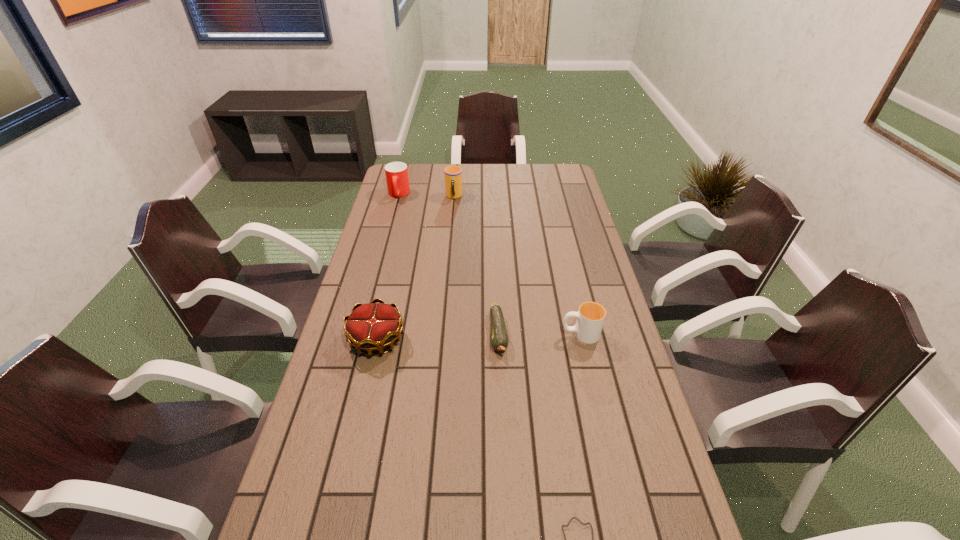
Identify the location of free space located with the handle on the side of the rightmost cup. The height and width of the screenshot is (540, 960). (517, 334).

Image resolution: width=960 pixels, height=540 pixels. I want to click on free space located on the back of the crown, so click(398, 244).

I want to click on vacant area located 0.070m at the blossom end of the zucchini, so click(500, 381).

You are a GUI agent. You are given a task and a screenshot of the screen. Output one action in this format:
    pyautogui.click(x=<x>, y=<y>)
    Task: Click on the object that is at the far edge
    
    Given the screenshot: What is the action you would take?
    pyautogui.click(x=397, y=179)

Where is `cup at the left edge`? This screenshot has width=960, height=540. cup at the left edge is located at coordinates (397, 179).

In order to click on crown located at the left edge in this screenshot , I will do `click(370, 327)`.

Find the location of `object located at the right edge`. object located at the right edge is located at coordinates (590, 318).

The width and height of the screenshot is (960, 540). I want to click on object that is at the far left corner, so click(397, 179).

In the image, there is a desktop. Where is `vacant space at the left edge`? Image resolution: width=960 pixels, height=540 pixels. vacant space at the left edge is located at coordinates coord(310,500).

In the image, there is a desktop. What are the coordinates of `free space at the right edge` in the screenshot? It's located at (548, 206).